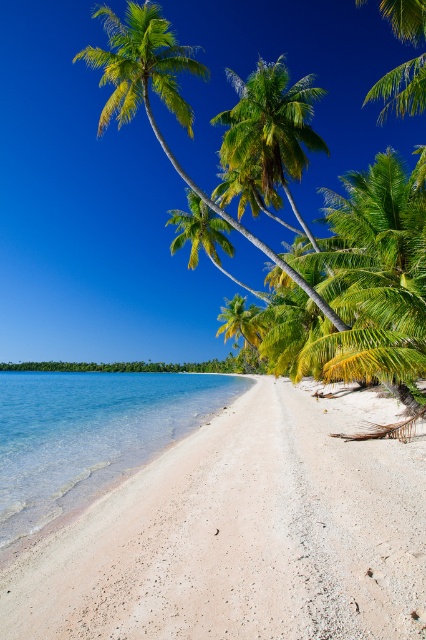
You are standing at the point marked by the coordinates point [241,534]. Based on the scene description, what is the immediate terrain you are standing on?

The point [241,534] indicates white sandy beach at center, so you are standing on a white sandy beach.

You are standing on the white sandy beach at center and want to reach the clear water at lower left. Which direction should you walk to get there quickly?

Since the white sandy beach at center has a lesser width compared to the clear water at lower left, you should walk towards the lower left direction to reach the clear water at lower left quickly.

You are standing on the white sandy beach at center and want to take a photo of the green leafy palm tree at upper left. Since you are holding a camera, will the palm tree be fully visible in your photo without any obstruction from the beach?

The white sandy beach at center is in front of the green leafy palm tree at upper left, so the palm tree will be partially obstructed by the beach in the foreground. Adjust your position to ensure the palm tree is fully visible.